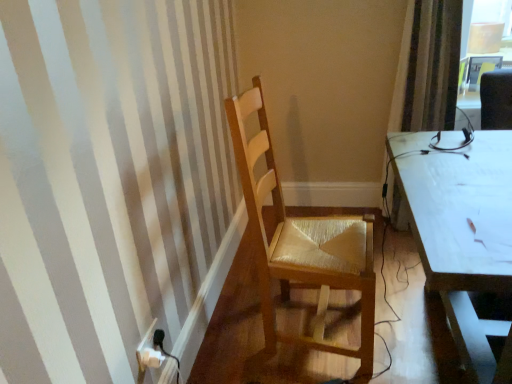
Where is `light brown wood chair at center`? light brown wood chair at center is located at coordinates (301, 245).

Image resolution: width=512 pixels, height=384 pixels. I want to click on striped fabric curtain at right, so click(x=433, y=66).

The image size is (512, 384). What are the coordinates of `light brown wood chair at center` in the screenshot? It's located at (301, 245).

How distant is white plastic power plugs and sockets at lower left from light brown wood chair at center?

white plastic power plugs and sockets at lower left and light brown wood chair at center are 68.94 centimeters apart from each other.

Which of these two, white plastic power plugs and sockets at lower left or light brown wood chair at center, stands taller?

light brown wood chair at center is taller.

From the image's perspective, is white plastic power plugs and sockets at lower left on light brown wood chair at center?

Actually, white plastic power plugs and sockets at lower left appears below light brown wood chair at center in the image.

In terms of width, does white plastic power plugs and sockets at lower left look wider or thinner when compared to light brown wood chair at center?

Considering their sizes, white plastic power plugs and sockets at lower left looks slimmer than light brown wood chair at center.

In the image, is light brown wood chair at center positioned in front of or behind striped fabric curtain at right?

Visually, light brown wood chair at center is located in front of striped fabric curtain at right.

I want to click on curtain behind the light brown wood chair at center, so click(x=433, y=66).

From the picture: Is light brown wood chair at center situated inside striped fabric curtain at right or outside?

light brown wood chair at center lies outside striped fabric curtain at right.

Considering the positions of points (260, 249) and (443, 52), is point (260, 249) closer to camera compared to point (443, 52)?

That is True.

In order to click on curtain located on the right of white plastic power plugs and sockets at lower left in this screenshot , I will do `click(433, 66)`.

Who is shorter, striped fabric curtain at right or white plastic power plugs and sockets at lower left?

white plastic power plugs and sockets at lower left.

Which of these two, striped fabric curtain at right or white plastic power plugs and sockets at lower left, is thinner?

white plastic power plugs and sockets at lower left.

Would you say striped fabric curtain at right contains white plastic power plugs and sockets at lower left?

No, white plastic power plugs and sockets at lower left is not a part of striped fabric curtain at right.

From the image's perspective, is light brown wood chair at center located above white plastic power plugs and sockets at lower left?

Yes, from the image's perspective, light brown wood chair at center is on top of white plastic power plugs and sockets at lower left.

The image size is (512, 384). I want to click on chair above the white plastic power plugs and sockets at lower left (from a real-world perspective), so click(301, 245).

Which is correct: light brown wood chair at center is inside white plastic power plugs and sockets at lower left, or outside of it?

light brown wood chair at center is not enclosed by white plastic power plugs and sockets at lower left.

Considering their positions, is light brown wood chair at center located in front of or behind white plastic power plugs and sockets at lower left?

light brown wood chair at center is positioned closer to the viewer than white plastic power plugs and sockets at lower left.

Is white plastic power plugs and sockets at lower left to the right of striped fabric curtain at right from the viewer's perspective?

In fact, white plastic power plugs and sockets at lower left is to the left of striped fabric curtain at right.

At what (x,y) coordinates should I click in order to perform the action: click on curtain above the white plastic power plugs and sockets at lower left (from the image's perspective). Please return your answer as a coordinate pair (x, y). Image resolution: width=512 pixels, height=384 pixels. Looking at the image, I should click on (433, 66).

From the image's perspective, which is below, white plastic power plugs and sockets at lower left or striped fabric curtain at right?

white plastic power plugs and sockets at lower left.

From the image's perspective, which object appears higher, striped fabric curtain at right or light brown wood chair at center?

From the image's view, striped fabric curtain at right is above.

Which is behind, striped fabric curtain at right or light brown wood chair at center?

striped fabric curtain at right is more distant.

Is the surface of striped fabric curtain at right in direct contact with light brown wood chair at center?

striped fabric curtain at right and light brown wood chair at center are clearly separated.

From a real-world perspective, relative to light brown wood chair at center, is striped fabric curtain at right vertically above or below?

From a real-world perspective, striped fabric curtain at right is physically above light brown wood chair at center.

This screenshot has height=384, width=512. What are the coordinates of `power plugs and sockets below the light brown wood chair at center (from the image's perspective)` in the screenshot? It's located at (149, 351).

Locate an element on the screen. This screenshot has height=384, width=512. curtain behind the light brown wood chair at center is located at coordinates (433, 66).

Considering their positions, is white plastic power plugs and sockets at lower left positioned further to light brown wood chair at center than striped fabric curtain at right?

The object further to light brown wood chair at center is striped fabric curtain at right.

When comparing their distances from light brown wood chair at center, does striped fabric curtain at right or white plastic power plugs and sockets at lower left seem further?

striped fabric curtain at right.

Which object lies nearer to the anchor point striped fabric curtain at right, light brown wood chair at center or white plastic power plugs and sockets at lower left?

Among the two, light brown wood chair at center is located nearer to striped fabric curtain at right.

Which object lies nearer to the anchor point white plastic power plugs and sockets at lower left, striped fabric curtain at right or light brown wood chair at center?

Based on the image, light brown wood chair at center appears to be nearer to white plastic power plugs and sockets at lower left.

Considering their positions, is white plastic power plugs and sockets at lower left positioned further to striped fabric curtain at right than light brown wood chair at center?

Based on the image, white plastic power plugs and sockets at lower left appears to be further to striped fabric curtain at right.

From the picture: Which object lies further to the anchor point white plastic power plugs and sockets at lower left, light brown wood chair at center or striped fabric curtain at right?

striped fabric curtain at right is further to white plastic power plugs and sockets at lower left.

This screenshot has width=512, height=384. I want to click on chair between white plastic power plugs and sockets at lower left and striped fabric curtain at right, so click(x=301, y=245).